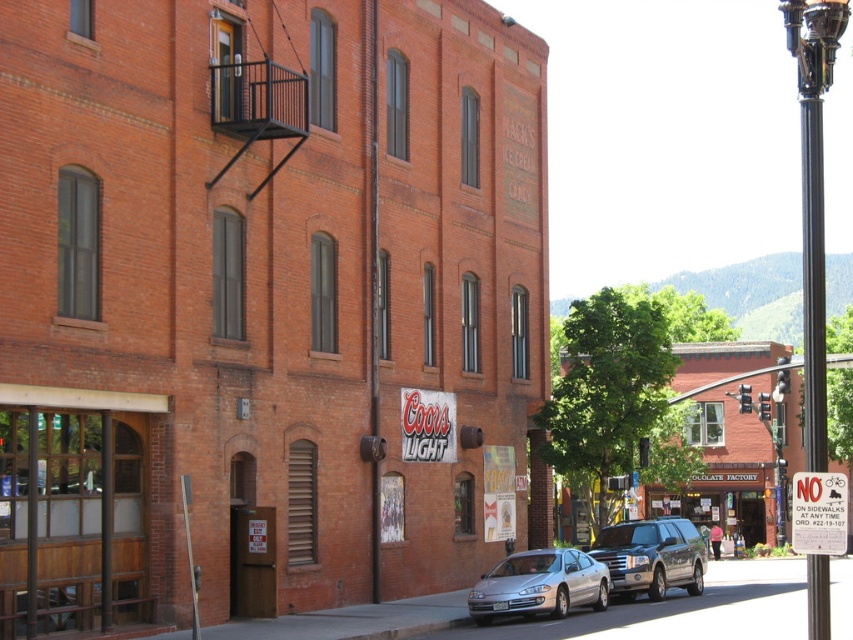
Question: From the image, what is the correct spatial relationship of black polished metal pole at right in relation to white plastic sign at lower right?

Choices:
 (A) below
 (B) above

Answer: (B)

Question: Is black polished metal pole at right wider than white plastic sign at lower right?

Choices:
 (A) no
 (B) yes

Answer: (B)

Question: Which object is farther from the camera taking this photo?

Choices:
 (A) shiny silver suv at center
 (B) silver metallic sedan at center
 (C) white plastic sign at lower right
 (D) black polished metal pole at right

Answer: (A)

Question: Which point is farther from the camera taking this photo?

Choices:
 (A) (811, 323)
 (B) (810, 467)
 (C) (676, 560)
 (D) (502, 604)

Answer: (C)

Question: Does black polished metal pole at right come in front of silver metallic sedan at center?

Choices:
 (A) no
 (B) yes

Answer: (B)

Question: Among these points, which one is farthest from the camera?

Choices:
 (A) (819, 52)
 (B) (807, 422)
 (C) (618, 561)

Answer: (C)